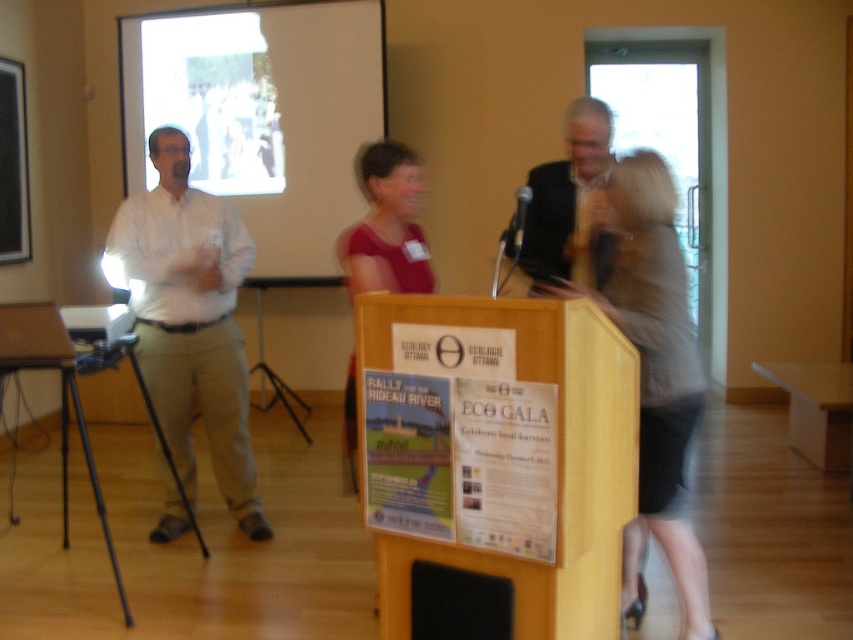
Question: Which of the following is the farthest from the observer?

Choices:
 (A) black matte speaker at lower center
 (B) black plastic microphone at center

Answer: (B)

Question: Where is matte red dress at center located in relation to shiny gold tie at center in the image?

Choices:
 (A) above
 (B) below

Answer: (B)

Question: Which object is positioned farthest from the silky gray dress at center?

Choices:
 (A) white matte projection screen at upper center
 (B) black plastic microphone at center
 (C) shiny gold tie at center
 (D) matte black projector at left

Answer: (A)

Question: Which object is the farthest from the matte red dress at center?

Choices:
 (A) white shirt at left
 (B) black plastic microphone at center

Answer: (A)

Question: Is silky gray dress at center in front of shiny gold tie at center?

Choices:
 (A) no
 (B) yes

Answer: (B)

Question: Is white shirt at left further to camera compared to shiny gold tie at center?

Choices:
 (A) yes
 (B) no

Answer: (A)